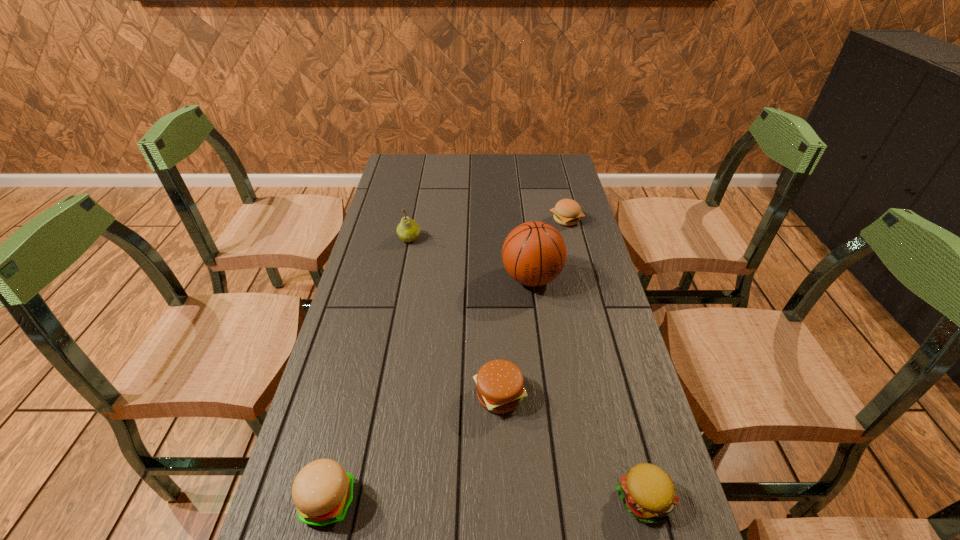
I want to click on the closest hamburger to the farthest object, so click(x=500, y=389).